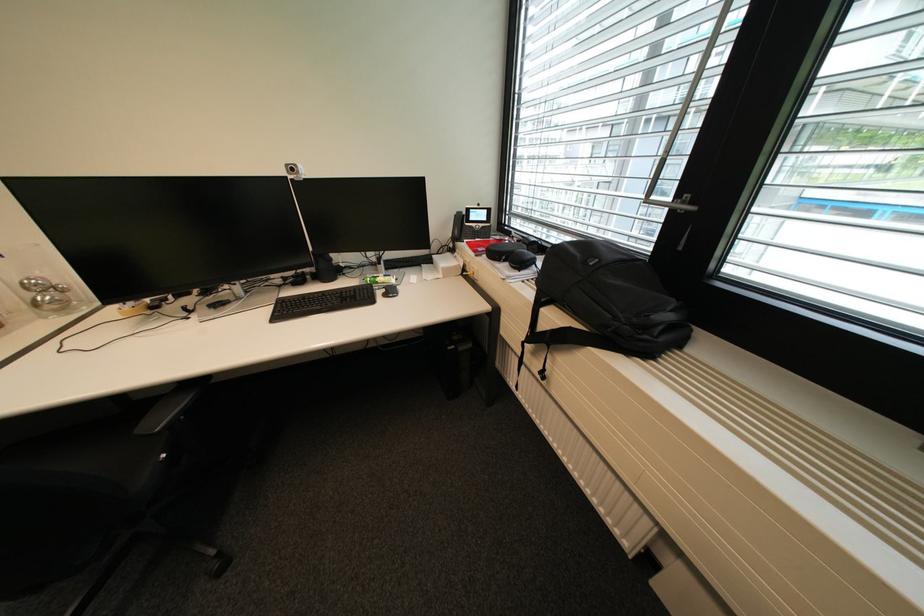
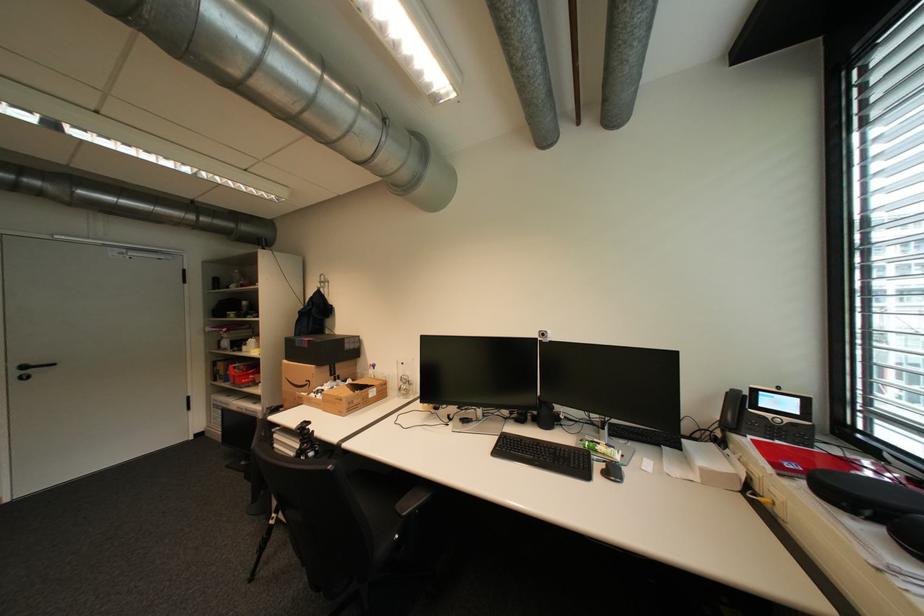
Where in the second image is the point corresponding to pixel 295 166 from the first image?

(548, 331)